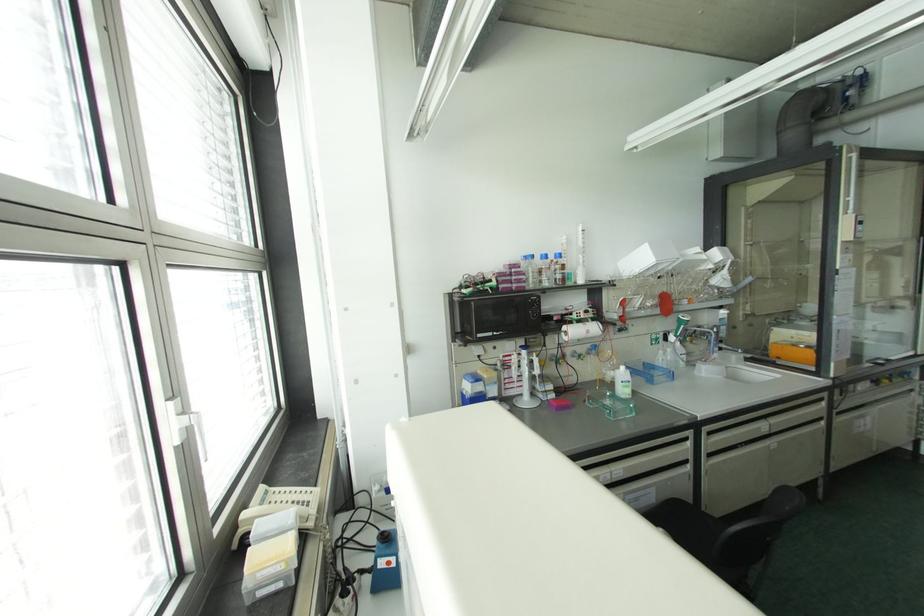
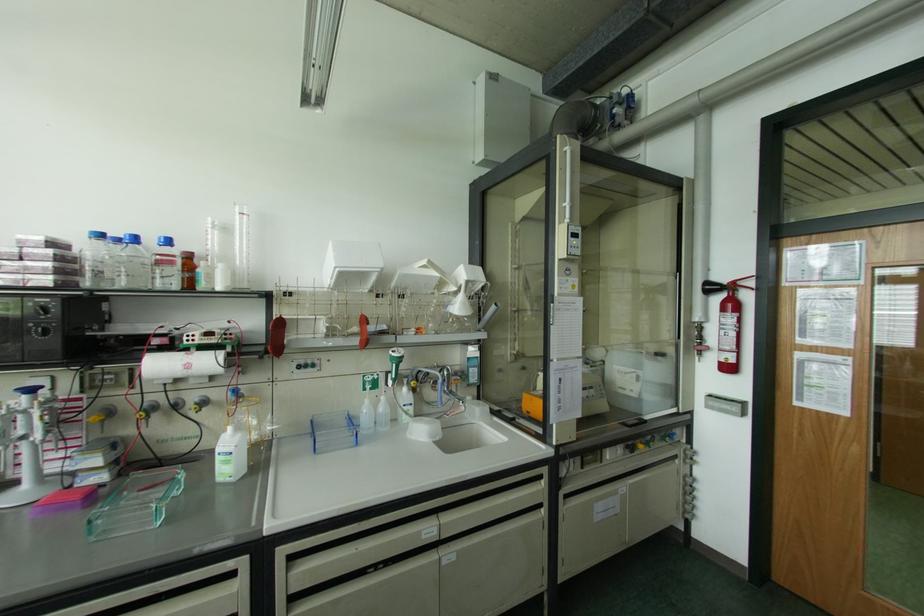
Where in the second image is the point corresponding to [669,349] from the first image?

(382, 398)